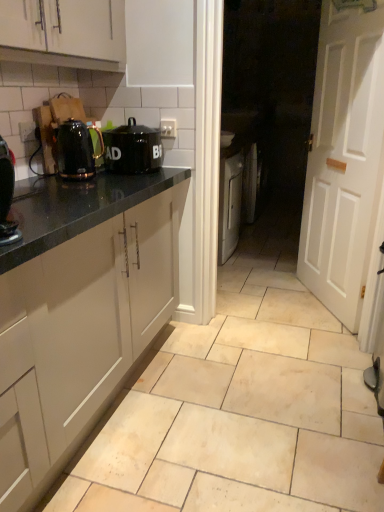
Question: Can you confirm if beige ceramic tile at center is positioned to the left of shiny black kettle at left?

Choices:
 (A) yes
 (B) no

Answer: (B)

Question: Can you confirm if beige ceramic tile at center is positioned to the right of shiny black kettle at left?

Choices:
 (A) yes
 (B) no

Answer: (A)

Question: Is beige ceramic tile at center smaller than shiny black kettle at left?

Choices:
 (A) no
 (B) yes

Answer: (A)

Question: Is beige ceramic tile at center in contact with shiny black kettle at left?

Choices:
 (A) no
 (B) yes

Answer: (A)

Question: Is there a large distance between beige ceramic tile at center and shiny black kettle at left?

Choices:
 (A) yes
 (B) no

Answer: (A)

Question: Is point (105, 140) closer or farther from the camera than point (337, 96)?

Choices:
 (A) farther
 (B) closer

Answer: (B)

Question: From a real-world perspective, is black matte canister at upper center above or below white wooden door at right?

Choices:
 (A) above
 (B) below

Answer: (A)

Question: Is black matte canister at upper center situated inside white wooden door at right or outside?

Choices:
 (A) inside
 (B) outside

Answer: (B)

Question: From the image's perspective, relative to white wooden door at right, is black matte canister at upper center above or below?

Choices:
 (A) above
 (B) below

Answer: (B)

Question: Considering their positions, is white matte cabinet at upper left located in front of or behind black glossy coffee machine at left?

Choices:
 (A) behind
 (B) front

Answer: (A)

Question: Is white matte cabinet at upper left taller or shorter than black glossy coffee machine at left?

Choices:
 (A) short
 (B) tall

Answer: (B)

Question: From a real-world perspective, is white matte cabinet at upper left physically located above or below black glossy coffee machine at left?

Choices:
 (A) above
 (B) below

Answer: (A)

Question: Visually, is white matte cabinet at upper left positioned to the left or to the right of black glossy coffee machine at left?

Choices:
 (A) left
 (B) right

Answer: (A)

Question: Is shiny black kettle at left in front of or behind beige ceramic tile at center in the image?

Choices:
 (A) behind
 (B) front

Answer: (A)

Question: Looking at their shapes, would you say shiny black kettle at left is wider or thinner than beige ceramic tile at center?

Choices:
 (A) wide
 (B) thin

Answer: (B)